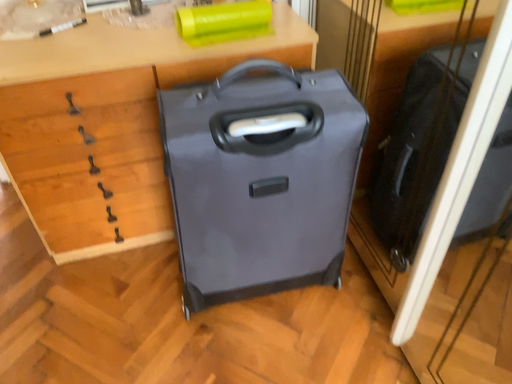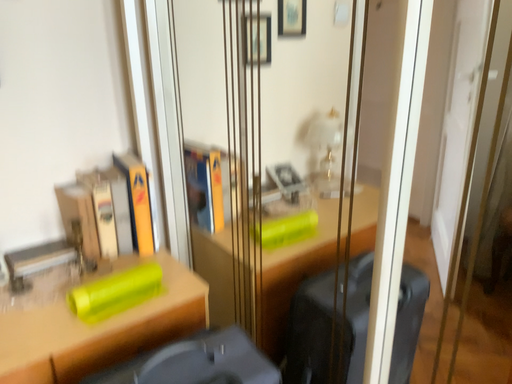
Question: How did the camera likely rotate when shooting the video?

Choices:
 (A) rotated right
 (B) rotated left

Answer: (A)